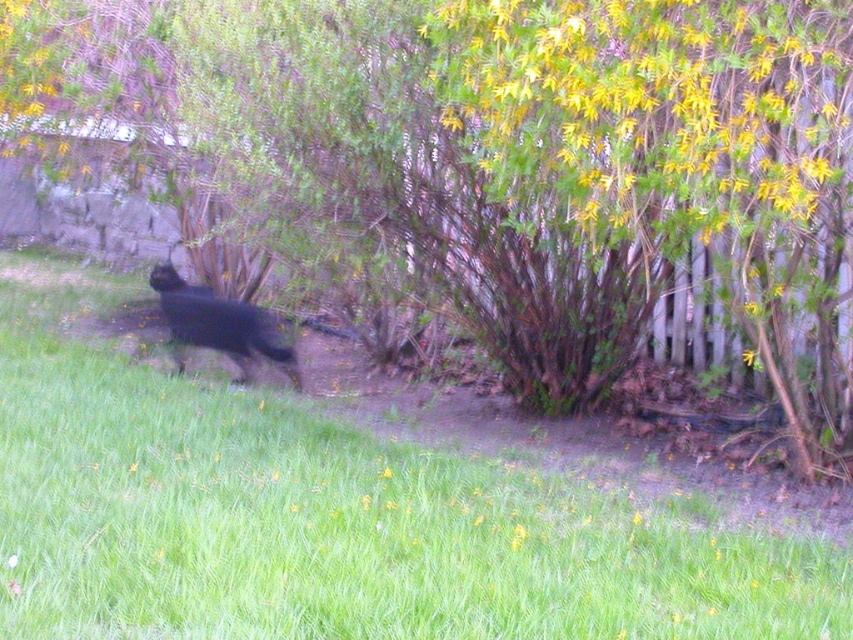
Between point (572, 627) and point (238, 314), which one is positioned behind?

The point (238, 314) is behind.

In the scene shown: Is green grass at lower left shorter than black furry dog at center?

Correct, green grass at lower left is not as tall as black furry dog at center.

Consider the image. Who is more distant from viewer, (x=9, y=554) or (x=212, y=314)?

Positioned behind is point (x=212, y=314).

In order to click on green grass at lower left in this screenshot , I will do `click(332, 518)`.